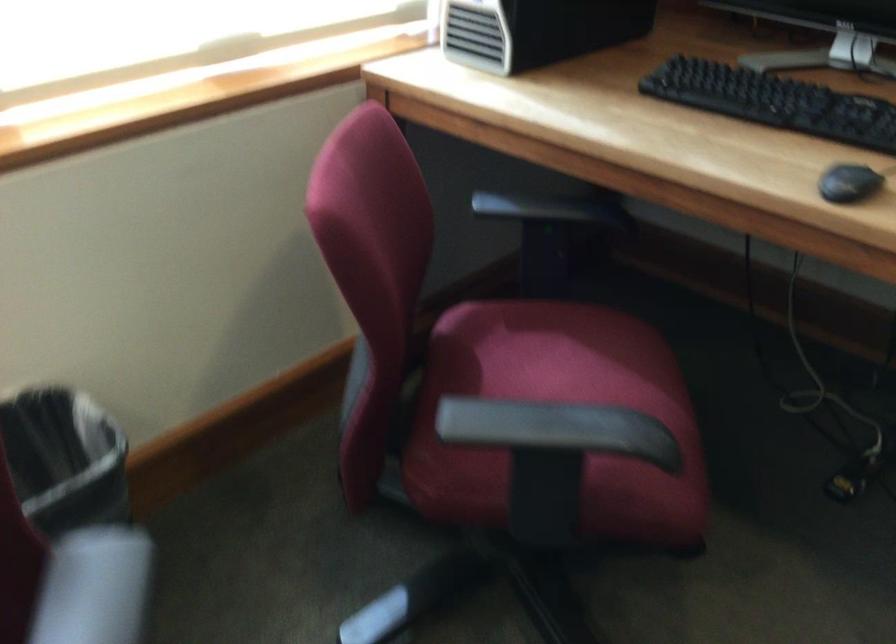
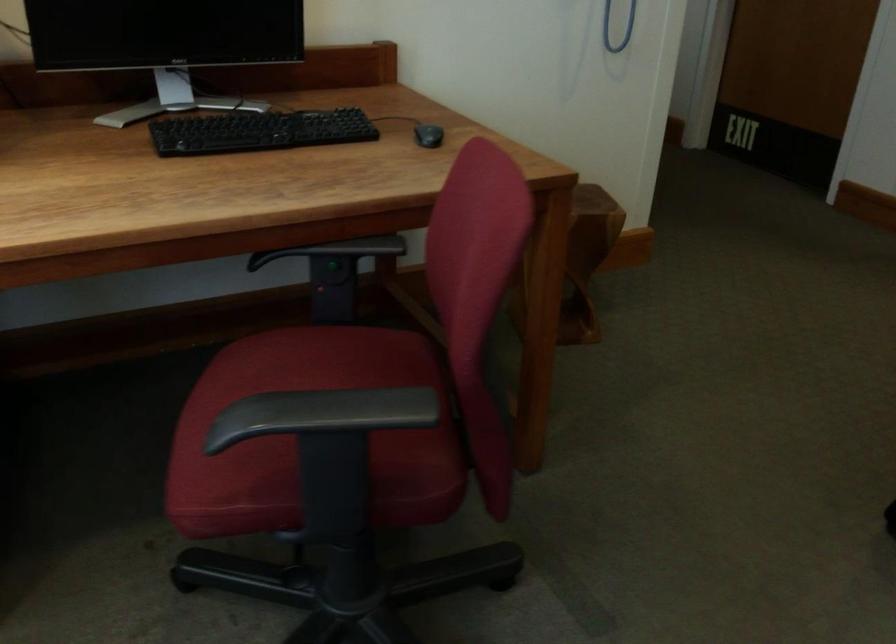
Question: The images are taken continuously from a first-person perspective. In which direction is your viewpoint rotating?

Choices:
 (A) Left
 (B) Right
 (C) Up
 (D) Down

Answer: (B)